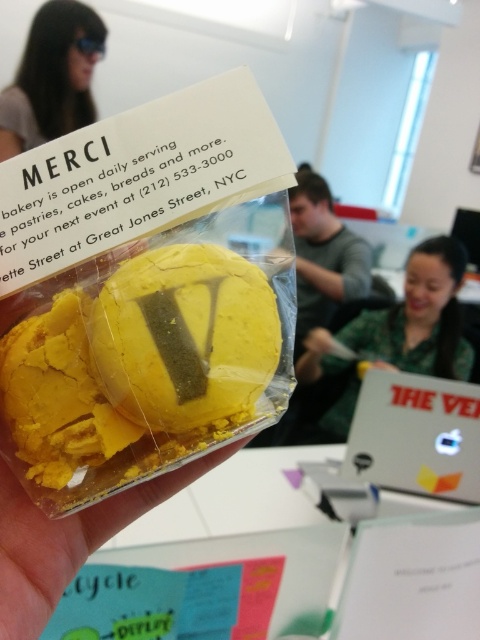
You are a baker who wants to place a decorative plate on the counter behind the yellow crumbly pastry at center. The plate requires a space of 20 inches. Is there enough space behind the pastry?

The distance between the yellow crumbly pastry at center and the viewer is 21.31 inches. Since the plate needs 20 inches, there is sufficient space behind the pastry to place the decorative plate.

You are an office worker who needs to identify which green shirt is closer to you. You see a green matte shirt at center and a green fabric shirt at upper center. Which one is closer to your current position?

The green matte shirt at center is closer to you because it is in front of the green fabric shirt at upper center.